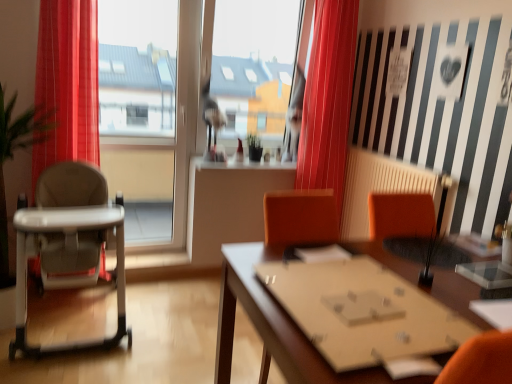
Question: Should I look upward or downward to see white plastic highchair at left?

Choices:
 (A) down
 (B) up

Answer: (A)

Question: Considering the relative sizes of transparent glass window at center and red velvet curtain at center in the image provided, is transparent glass window at center shorter than red velvet curtain at center?

Choices:
 (A) yes
 (B) no

Answer: (B)

Question: Is transparent glass window at center positioned in front of red velvet curtain at center?

Choices:
 (A) yes
 (B) no

Answer: (B)

Question: Could you tell me if transparent glass window at center is turned towards red velvet curtain at center?

Choices:
 (A) no
 (B) yes

Answer: (A)

Question: Can you confirm if transparent glass window at center is wider than red velvet curtain at center?

Choices:
 (A) no
 (B) yes

Answer: (A)

Question: From a real-world perspective, is transparent glass window at center under red velvet curtain at center?

Choices:
 (A) no
 (B) yes

Answer: (B)

Question: Considering the relative sizes of transparent glass window at center and red velvet curtain at center in the image provided, is transparent glass window at center taller than red velvet curtain at center?

Choices:
 (A) yes
 (B) no

Answer: (A)

Question: Does wooden table at center have a larger size compared to red velvet curtain at center?

Choices:
 (A) no
 (B) yes

Answer: (B)

Question: Does wooden table at center turn towards red velvet curtain at center?

Choices:
 (A) yes
 (B) no

Answer: (B)

Question: Is wooden table at center turned away from red velvet curtain at center?

Choices:
 (A) yes
 (B) no

Answer: (B)

Question: Is wooden table at center positioned before red velvet curtain at center?

Choices:
 (A) yes
 (B) no

Answer: (A)

Question: From a real-world perspective, is wooden table at center positioned under red velvet curtain at center based on gravity?

Choices:
 (A) yes
 (B) no

Answer: (A)

Question: From the image's perspective, is wooden table at center on red velvet curtain at center?

Choices:
 (A) yes
 (B) no

Answer: (B)

Question: Does red velvet curtain at center have a greater height compared to wooden table at center?

Choices:
 (A) no
 (B) yes

Answer: (B)